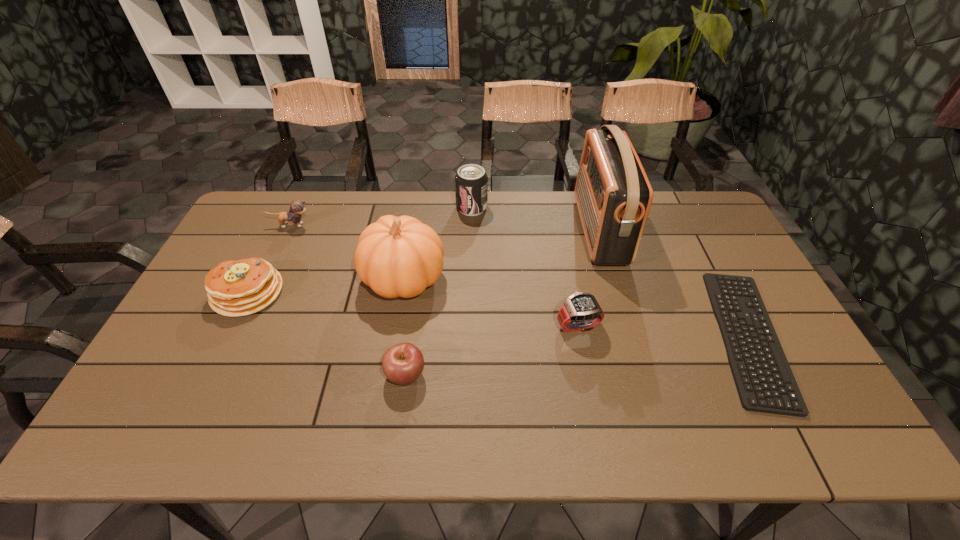
Locate an element on the screen. The width and height of the screenshot is (960, 540). vacant space located on the back of the shortest object is located at coordinates (699, 242).

The width and height of the screenshot is (960, 540). I want to click on radio receiver positioned at the far edge, so click(x=613, y=194).

This screenshot has width=960, height=540. I want to click on soda can located at the far edge, so click(471, 182).

Locate an element on the screen. kitten present at the far edge is located at coordinates (297, 208).

Find the location of a particular element. The height and width of the screenshot is (540, 960). object present at the near edge is located at coordinates [765, 383].

Identify the location of kitten at the left edge. (297, 208).

Image resolution: width=960 pixels, height=540 pixels. Find the location of `pancake at the left edge`. pancake at the left edge is located at coordinates (234, 288).

Image resolution: width=960 pixels, height=540 pixels. Identify the location of object situated at the right edge. (765, 383).

Where is `object located at the far left corner`? This screenshot has width=960, height=540. object located at the far left corner is located at coordinates (297, 208).

You are a GUI agent. You are given a task and a screenshot of the screen. Output one action in this format:
    pyautogui.click(x=<x>, y=<y>)
    Task: Click on the object that is at the near right corner
    Image resolution: width=960 pixels, height=540 pixels.
    Given the screenshot: What is the action you would take?
    pyautogui.click(x=765, y=383)